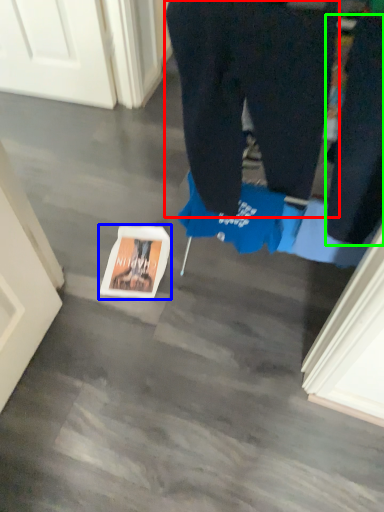
Question: Considering the real-world distances, which object is farthest from trousers (highlighted by a red box)? copy (highlighted by a blue box) or pants (highlighted by a green box)?

Choices:
 (A) copy
 (B) pants

Answer: (A)